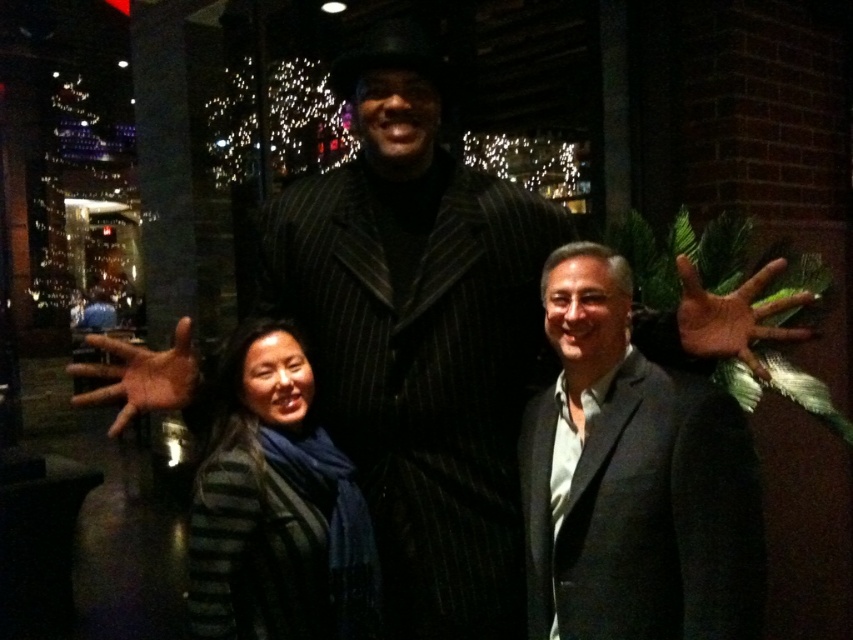
From the picture: Is striped sweater at center to the right of brown leather hand at center from the viewer's perspective?

In fact, striped sweater at center is to the left of brown leather hand at center.

Which is more to the left, striped sweater at center or brown leather hand at center?

striped sweater at center is more to the left.

Between point (230, 444) and point (752, 326), which one is positioned behind?

Positioned behind is point (230, 444).

Locate an element on the screen. striped sweater at center is located at coordinates (277, 509).

Can you confirm if brown leather hand at center is bigger than brown leather hand at lower left?

Correct, brown leather hand at center is larger in size than brown leather hand at lower left.

Locate an element on the screen. brown leather hand at center is located at coordinates (733, 316).

The width and height of the screenshot is (853, 640). Find the location of `brown leather hand at center`. brown leather hand at center is located at coordinates (733, 316).

Can you confirm if matte black suit at center is thinner than striped sweater at center?

No.

Which is above, matte black suit at center or striped sweater at center?

matte black suit at center

Which is in front, point (606, 376) or point (289, 580)?

Positioned in front is point (289, 580).

Where is `matte black suit at center`? This screenshot has width=853, height=640. matte black suit at center is located at coordinates (631, 480).